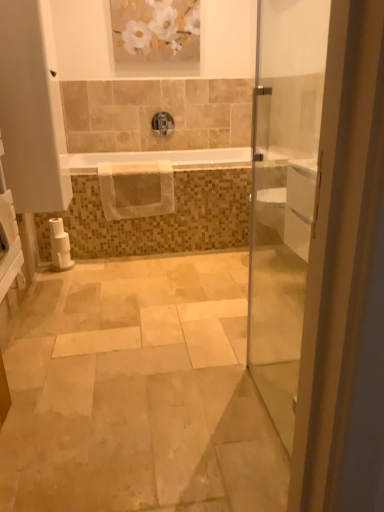
The width and height of the screenshot is (384, 512). In order to click on vacant point to the left of white glossy door at right in this screenshot , I will do `click(194, 413)`.